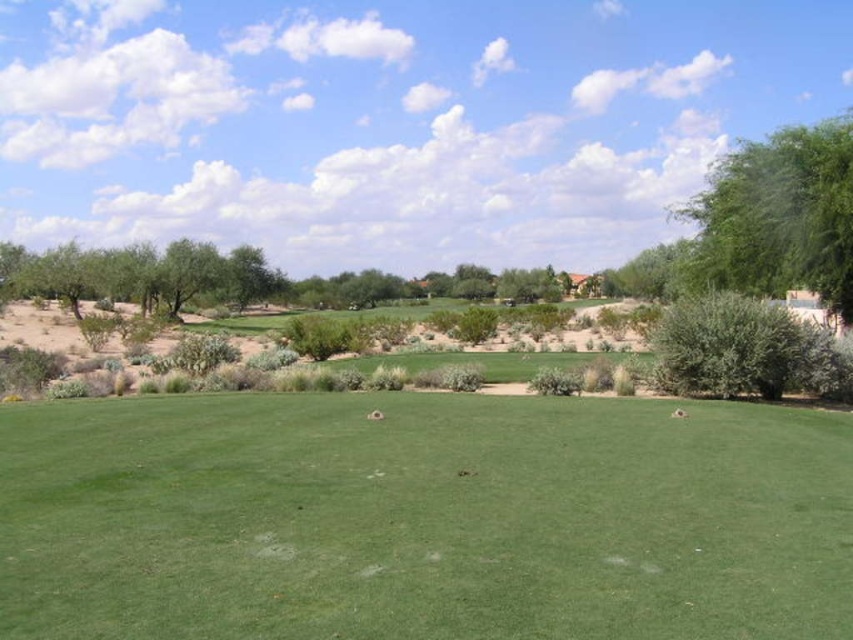
Question: Does green smooth grass at center have a smaller size compared to green leafy tree at upper right?

Choices:
 (A) no
 (B) yes

Answer: (B)

Question: Based on their relative distances, which object is nearer to the green leafy tree at upper right?

Choices:
 (A) green smooth grass at center
 (B) green leafy tree at center
 (C) green leafy tree at left

Answer: (A)

Question: Which of the following is the closest to the observer?

Choices:
 (A) (123, 257)
 (B) (798, 186)

Answer: (B)

Question: Is green leafy tree at upper right smaller than green leafy tree at center?

Choices:
 (A) yes
 (B) no

Answer: (B)

Question: Among these points, which one is farthest from the camera?

Choices:
 (A) (822, 180)
 (B) (221, 260)
 (C) (360, 499)
 (D) (219, 298)

Answer: (D)

Question: Does green leafy tree at upper right appear under green leafy tree at left?

Choices:
 (A) no
 (B) yes

Answer: (A)